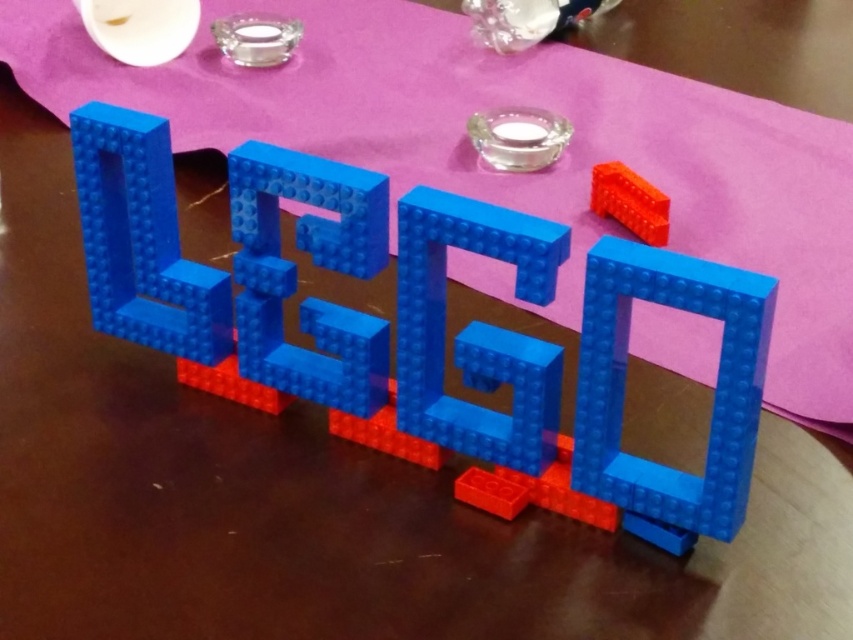
Question: Which point is closer to the camera?

Choices:
 (A) (618, 324)
 (B) (167, 182)

Answer: (A)

Question: Among these objects, which one is nearest to the camera?

Choices:
 (A) blue plastic letter l at center
 (B) blue plastic letter g at center
 (C) rubber brick at upper right
 (D) translucent blue plastic square at center

Answer: (D)

Question: Which object is positioned closest to the translucent blue plastic square at center?

Choices:
 (A) blue plastic letter l at center
 (B) blue plastic letter g at center

Answer: (B)

Question: Is blue plastic letter g at center to the left of rubber brick at upper right from the viewer's perspective?

Choices:
 (A) yes
 (B) no

Answer: (A)

Question: Is blue plastic letter l at center positioned before rubber brick at upper right?

Choices:
 (A) no
 (B) yes

Answer: (B)

Question: Does translucent blue plastic square at center appear on the left side of blue plastic letter l at center?

Choices:
 (A) no
 (B) yes

Answer: (A)